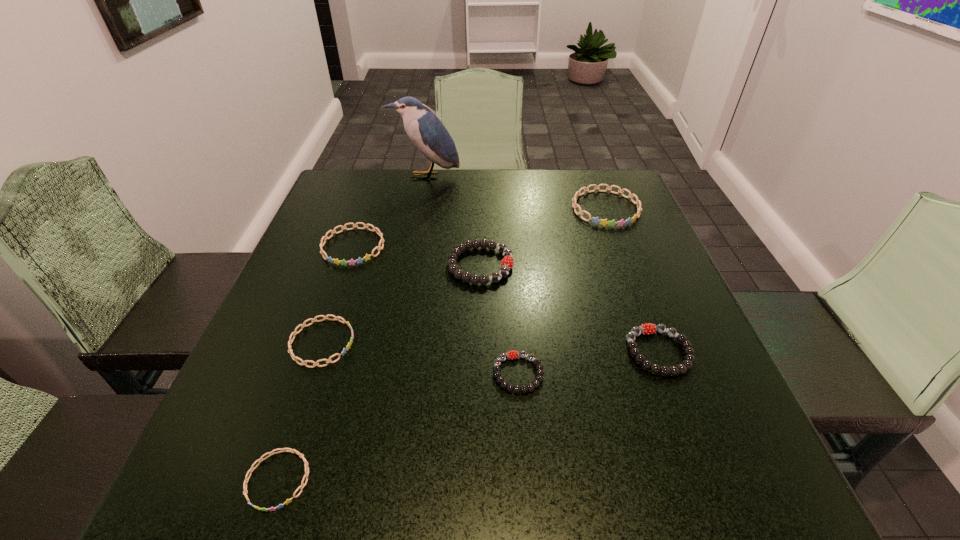
Image resolution: width=960 pixels, height=540 pixels. In order to click on unoccupied area between the third biggest blue bracelet and the second biggest blue bracelet in this screenshot , I will do `click(338, 295)`.

I want to click on vacant point located between the biggest blue bracelet and the shortest bracelet, so click(x=442, y=344).

Find the location of `empty location between the farthest black bracelet and the third biggest blue bracelet`. empty location between the farthest black bracelet and the third biggest blue bracelet is located at coordinates (401, 304).

The height and width of the screenshot is (540, 960). I want to click on unoccupied area between the shortest object and the rightmost black bracelet, so (x=468, y=416).

Find the location of a particular element. free space between the biggest black bracelet and the third smallest blue bracelet is located at coordinates (417, 256).

Locate an element on the screen. The height and width of the screenshot is (540, 960). vacant region between the second biggest blue bracelet and the rightmost black bracelet is located at coordinates (506, 299).

The height and width of the screenshot is (540, 960). What are the coordinates of `free space that is in between the rightmost blue bracelet and the second smallest black bracelet` in the screenshot? It's located at (633, 280).

At what (x,y) coordinates should I click in order to perform the action: click on object that is the sixth closest to the nearest bracelet. Please return your answer as a coordinate pair (x, y). Looking at the image, I should click on (604, 222).

I want to click on object that is the seventh closest to the rightmost black bracelet, so click(426, 131).

Locate which bracelet is the second closest to the farthest black bracelet. Please provide its 2D coordinates. Your answer should be formatted as a tuple, i.e. [(x, y)], where the tuple contains the x and y coordinates of a point satisfying the conditions above.

[(513, 354)]